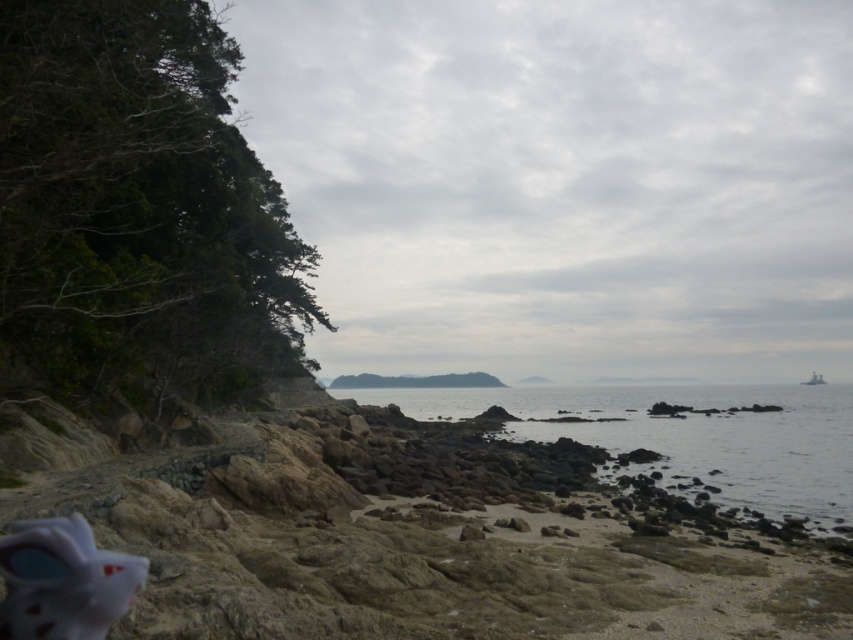
Can you confirm if rocky beach at lower left is wider than clear water at center?

Incorrect, rocky beach at lower left's width does not surpass clear water at center's.

From the picture: Can you confirm if rocky beach at lower left is positioned above clear water at center?

Indeed, rocky beach at lower left is positioned over clear water at center.

Where is `rocky beach at lower left`? rocky beach at lower left is located at coordinates (415, 531).

This screenshot has width=853, height=640. I want to click on rocky beach at lower left, so click(415, 531).